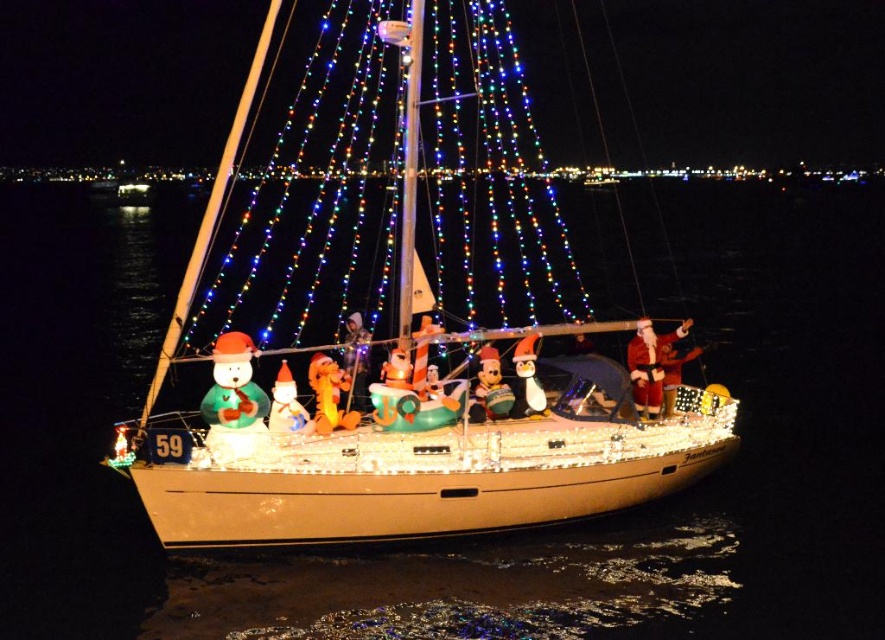
From the picture: You are standing on the dock looking at the festive sailboat. Which object is closer to you between the illuminated string lights at center and the green matte snowman at center?

The illuminated string lights at center are closer to the viewer than the green matte snowman at center.

You are a photographer planning to take a photo of the festive sailboat. You notice two snowmen on the deck, the green matte snowman at center and the matte plastic snowman at center. Which snowman should you focus on to ensure it appears taller in the photo?

The matte plastic snowman at center is taller than the green matte snowman at center, so focusing on the matte plastic snowman at center will ensure it appears taller in the photo.

You are standing on the deck of the sailboat and want to see both the green matte snowman at center and the matte plastic snowman at center. Which one is closer to you?

The green matte snowman at center is closer to you because it is in front of the matte plastic snowman at center.